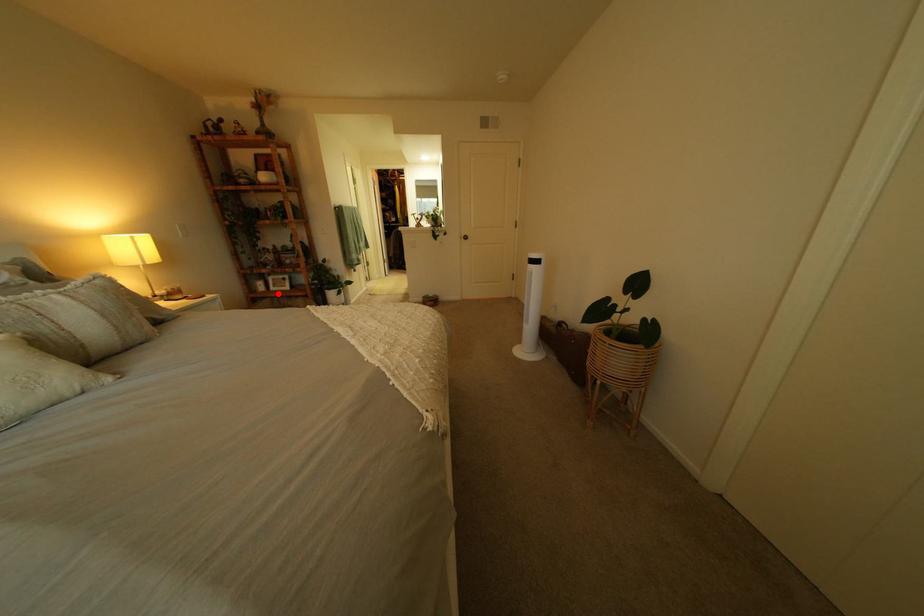
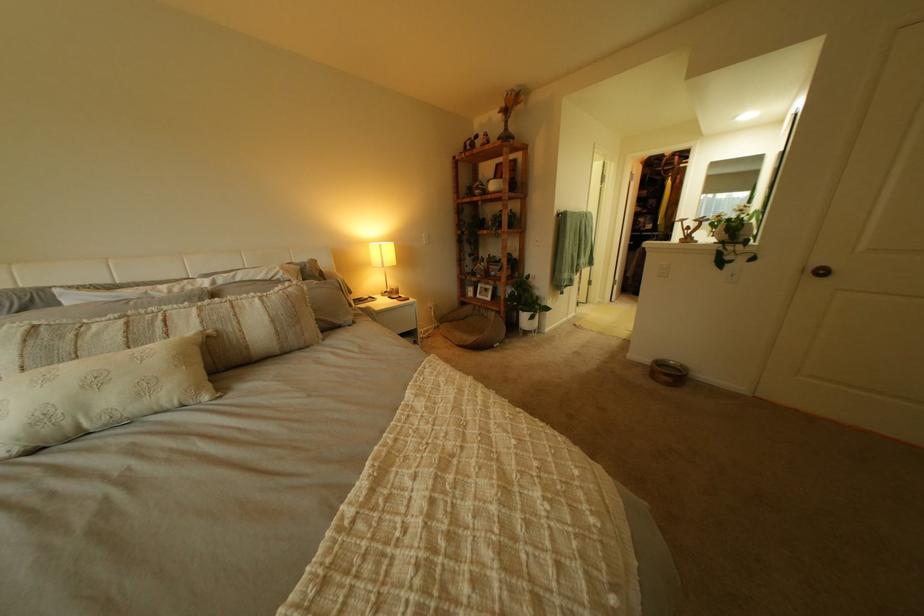
Find the pixel in the second image that matches the highlighted location in the first image.

(485, 300)